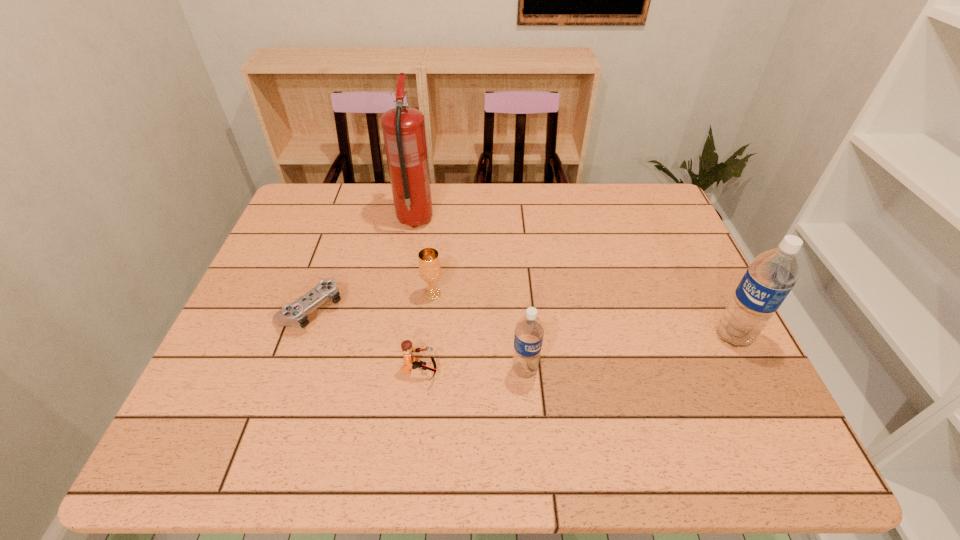
Identify the location of empty space between the fourth shortest object and the leftmost object. This screenshot has height=540, width=960. (418, 339).

Identify the location of empty space that is in between the chalice and the fifth tallest object. (426, 333).

Where is `empty space between the fire extinguisher and the left water bottle`? This screenshot has height=540, width=960. empty space between the fire extinguisher and the left water bottle is located at coordinates (470, 295).

This screenshot has height=540, width=960. Find the location of `free point between the second shortest object and the taller water bottle`. free point between the second shortest object and the taller water bottle is located at coordinates (x=577, y=354).

Identify the location of empty space between the leftmost object and the Lego. (366, 340).

This screenshot has width=960, height=540. In order to click on empty space between the second shortest object and the farthest object in this screenshot , I will do `click(418, 296)`.

You are a GUI agent. You are given a task and a screenshot of the screen. Output one action in this format:
    pyautogui.click(x=<x>, y=<y>)
    Task: Click on the empty space between the Lego and the control
    The width and height of the screenshot is (960, 540).
    Given the screenshot: What is the action you would take?
    pyautogui.click(x=366, y=340)

Locate an element on the screen. This screenshot has width=960, height=540. object that is the fourth closest one to the tallest object is located at coordinates (529, 331).

The width and height of the screenshot is (960, 540). I want to click on object that ranks as the fifth closest to the tallest object, so (x=771, y=276).

Where is `vacant point that satisfies the following two spatial constraints: 1. on the front side of the fifth shortest object; 2. holding a crossbow in the hands of the second shortest object`? vacant point that satisfies the following two spatial constraints: 1. on the front side of the fifth shortest object; 2. holding a crossbow in the hands of the second shortest object is located at coordinates (751, 371).